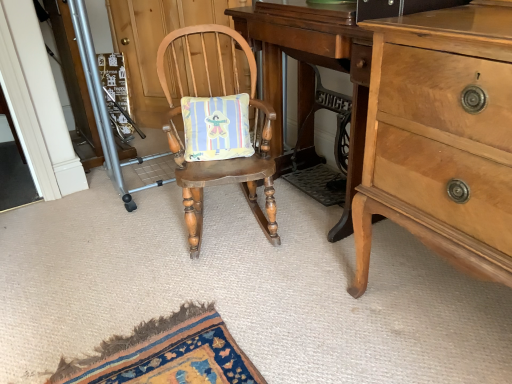
Question: From a real-world perspective, is metallic silver screen door at left under light brown wood dresser at right?

Choices:
 (A) no
 (B) yes

Answer: (A)

Question: Is metallic silver screen door at left facing towards light brown wood dresser at right?

Choices:
 (A) no
 (B) yes

Answer: (A)

Question: Considering the relative sizes of metallic silver screen door at left and light brown wood dresser at right in the image provided, is metallic silver screen door at left smaller than light brown wood dresser at right?

Choices:
 (A) no
 (B) yes

Answer: (B)

Question: Does metallic silver screen door at left appear on the right side of light brown wood dresser at right?

Choices:
 (A) yes
 (B) no

Answer: (B)

Question: Is metallic silver screen door at left placed right next to light brown wood dresser at right?

Choices:
 (A) no
 (B) yes

Answer: (A)

Question: Is light brown wood dresser at right spatially inside wooden rocking chair at center, or outside of it?

Choices:
 (A) outside
 (B) inside

Answer: (A)

Question: Is light brown wood dresser at right in front of or behind wooden rocking chair at center in the image?

Choices:
 (A) behind
 (B) front

Answer: (B)

Question: Visually, is light brown wood dresser at right positioned to the left or to the right of wooden rocking chair at center?

Choices:
 (A) left
 (B) right

Answer: (B)

Question: Is light brown wood dresser at right bigger or smaller than wooden rocking chair at center?

Choices:
 (A) small
 (B) big

Answer: (B)

Question: In the image, is wooden rocking chair at center on the left side or the right side of light brown wood changing table at center?

Choices:
 (A) left
 (B) right

Answer: (A)

Question: From a real-world perspective, relative to light brown wood changing table at center, is wooden rocking chair at center vertically above or below?

Choices:
 (A) below
 (B) above

Answer: (A)

Question: Is wooden rocking chair at center bigger or smaller than light brown wood changing table at center?

Choices:
 (A) big
 (B) small

Answer: (B)

Question: Considering the positions of wooden rocking chair at center and light brown wood changing table at center in the image, is wooden rocking chair at center wider or thinner than light brown wood changing table at center?

Choices:
 (A) thin
 (B) wide

Answer: (B)

Question: Considering the positions of metallic silver screen door at left and light brown wood dresser at right in the image, is metallic silver screen door at left wider or thinner than light brown wood dresser at right?

Choices:
 (A) wide
 (B) thin

Answer: (B)

Question: From a real-world perspective, is metallic silver screen door at left above or below light brown wood dresser at right?

Choices:
 (A) above
 (B) below

Answer: (A)